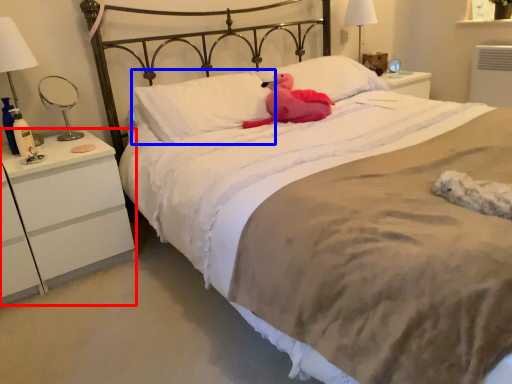
Question: Which of the following is the farthest to the observer, nightstand (highlighted by a red box) or pillow (highlighted by a blue box)?

Choices:
 (A) nightstand
 (B) pillow

Answer: (B)